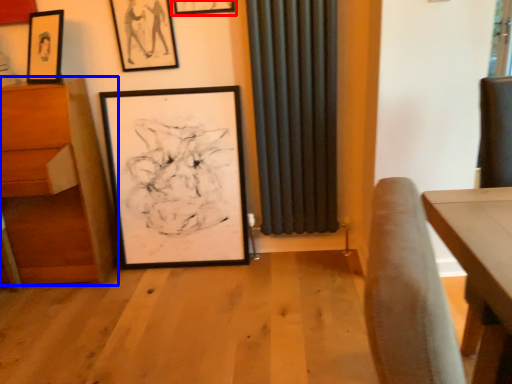
Question: Among these objects, which one is nearest to the camera, picture frame (highlighted by a red box) or furniture (highlighted by a blue box)?

Choices:
 (A) picture frame
 (B) furniture

Answer: (B)